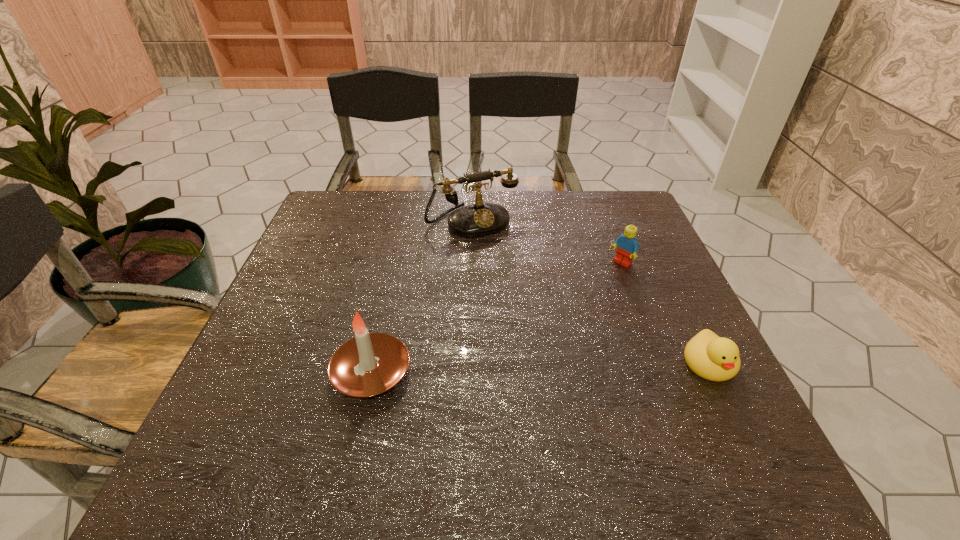
The width and height of the screenshot is (960, 540). In the image, there is a desktop. In order to click on vacant space at the far left corner in this screenshot , I will do `click(348, 204)`.

I want to click on free space at the near left corner, so click(279, 427).

Where is `vacant space at the far right corner of the desktop`? vacant space at the far right corner of the desktop is located at coordinates (594, 224).

The height and width of the screenshot is (540, 960). I want to click on vacant space at the near right corner, so click(692, 415).

Find the location of a particular element. Image resolution: width=960 pixels, height=540 pixels. free space between the duckling and the second shortest object is located at coordinates (665, 314).

Find the location of a particular element. The height and width of the screenshot is (540, 960). vacant space that's between the farthest object and the duckling is located at coordinates (590, 293).

Image resolution: width=960 pixels, height=540 pixels. Identify the location of free space between the shortest object and the candle. (540, 368).

At what (x,y) coordinates should I click in order to perform the action: click on free space between the shortest object and the third nearest object. Please return your answer as a coordinate pair (x, y). This screenshot has height=540, width=960. Looking at the image, I should click on (665, 314).

Identify the location of unoccupied position between the rightmost object and the candle. (540, 368).

At what (x,y) coordinates should I click in order to perform the action: click on free area in between the candle and the third tallest object. Please return your answer as a coordinate pair (x, y). Looking at the image, I should click on (496, 318).